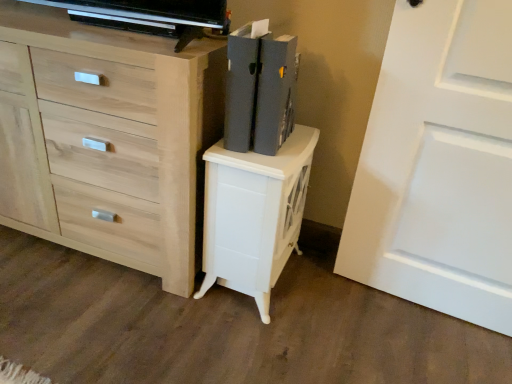
Question: Is matte gray book at upper right not inside white matte door at right?

Choices:
 (A) no
 (B) yes

Answer: (B)

Question: From the image's perspective, is matte gray book at upper right under white matte door at right?

Choices:
 (A) no
 (B) yes

Answer: (A)

Question: Can you confirm if matte gray book at upper right is bigger than white matte door at right?

Choices:
 (A) no
 (B) yes

Answer: (A)

Question: Is the surface of matte gray book at upper right in direct contact with white matte door at right?

Choices:
 (A) no
 (B) yes

Answer: (A)

Question: Would you consider matte gray book at upper right to be distant from white matte door at right?

Choices:
 (A) yes
 (B) no

Answer: (B)

Question: Considering the positions of light wood chest of drawers at center and white glossy nightstand at center in the image, is light wood chest of drawers at center bigger or smaller than white glossy nightstand at center?

Choices:
 (A) small
 (B) big

Answer: (B)

Question: In the image, is light wood chest of drawers at center on the left side or the right side of white glossy nightstand at center?

Choices:
 (A) left
 (B) right

Answer: (A)

Question: Choose the correct answer: Is light wood chest of drawers at center inside white glossy nightstand at center or outside it?

Choices:
 (A) outside
 (B) inside

Answer: (A)

Question: From a real-world perspective, is light wood chest of drawers at center physically located above or below white glossy nightstand at center?

Choices:
 (A) below
 (B) above

Answer: (B)

Question: Which is correct: white glossy nightstand at center is inside white matte door at right, or outside of it?

Choices:
 (A) inside
 (B) outside

Answer: (B)

Question: Is white glossy nightstand at center bigger or smaller than white matte door at right?

Choices:
 (A) small
 (B) big

Answer: (B)

Question: In terms of height, does white glossy nightstand at center look taller or shorter compared to white matte door at right?

Choices:
 (A) tall
 (B) short

Answer: (B)

Question: Is point (200, 289) closer or farther from the camera than point (489, 284)?

Choices:
 (A) farther
 (B) closer

Answer: (A)

Question: From the image's perspective, is white matte door at right above or below matte gray book at upper right?

Choices:
 (A) above
 (B) below

Answer: (B)

Question: Is point (420, 49) closer or farther from the camera than point (251, 89)?

Choices:
 (A) farther
 (B) closer

Answer: (A)